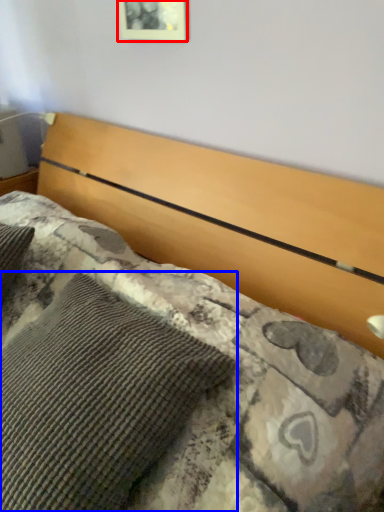
Question: Which of the following is the closest to the observer, picture frame (highlighted by a red box) or pillow (highlighted by a blue box)?

Choices:
 (A) picture frame
 (B) pillow

Answer: (B)